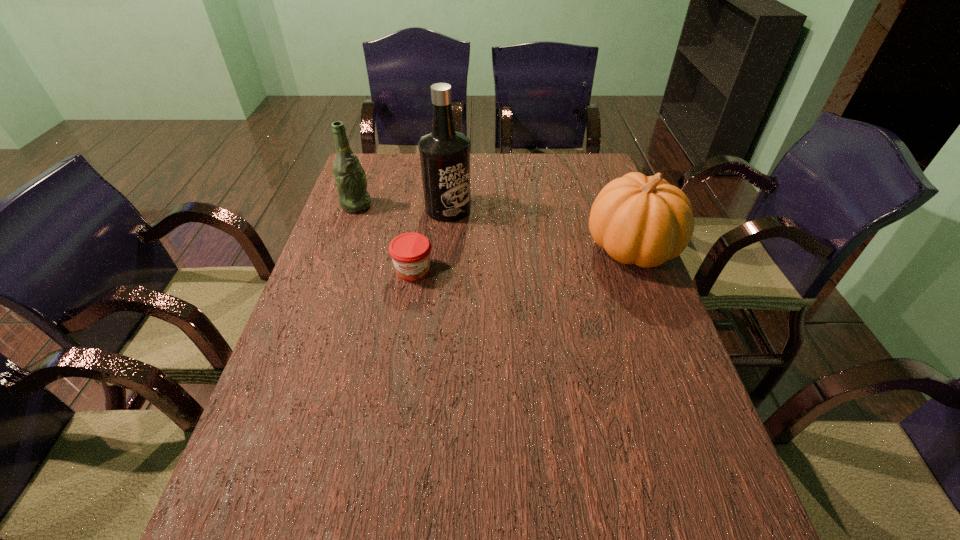
Find the location of `vacant space located on the surface of the beer bottle`. vacant space located on the surface of the beer bottle is located at coordinates (435, 232).

The image size is (960, 540). I want to click on vacant space located on the surface of the beer bottle, so click(399, 220).

This screenshot has height=540, width=960. In order to click on object at the left edge in this screenshot , I will do `click(350, 177)`.

Where is `object that is positioned at the right edge`? object that is positioned at the right edge is located at coordinates (643, 220).

Where is `vacant space at the far edge of the desktop`? vacant space at the far edge of the desktop is located at coordinates (414, 158).

In the image, there is a desktop. At what (x,y) coordinates should I click in order to perform the action: click on vacant space at the near edge. Please return your answer as a coordinate pair (x, y). The height and width of the screenshot is (540, 960). Looking at the image, I should click on (580, 490).

Image resolution: width=960 pixels, height=540 pixels. In order to click on free space at the left edge in this screenshot , I will do `click(329, 246)`.

The height and width of the screenshot is (540, 960). What are the coordinates of `free space at the right edge` in the screenshot? It's located at (639, 348).

This screenshot has height=540, width=960. In the image, there is a desktop. Find the location of `vacant space at the far right corner`. vacant space at the far right corner is located at coordinates (566, 186).

Where is `free space at the near right corner of the desktop`? free space at the near right corner of the desktop is located at coordinates (648, 492).